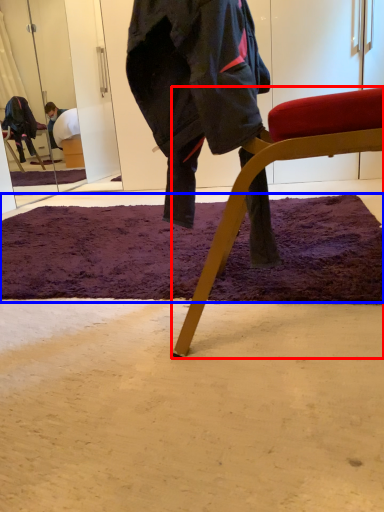
Question: Which object is further to the camera taking this photo, chair (highlighted by a red box) or mat (highlighted by a blue box)?

Choices:
 (A) chair
 (B) mat

Answer: (B)